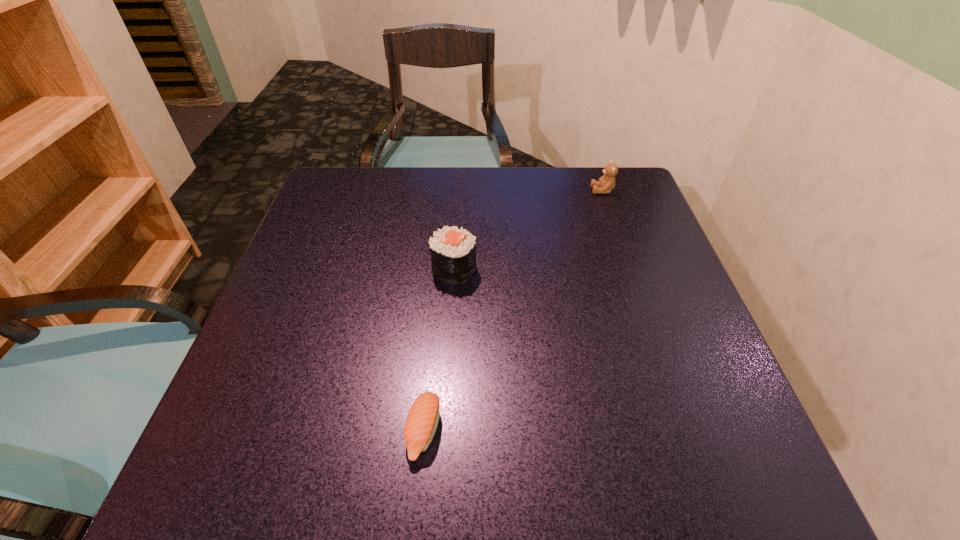
The image size is (960, 540). Find the location of `free region at the far right corner of the desktop`. free region at the far right corner of the desktop is located at coordinates (609, 201).

The height and width of the screenshot is (540, 960). Identify the location of vacant region between the nearer sushi and the rightmost object. (513, 311).

The image size is (960, 540). Identify the location of free spot between the taller sushi and the teddy bear. (528, 230).

Where is `blank region between the second nearest object and the nearest object`? The height and width of the screenshot is (540, 960). blank region between the second nearest object and the nearest object is located at coordinates (439, 350).

I want to click on free point between the shorter sushi and the farther sushi, so click(x=439, y=350).

Where is `free space between the nearest object and the second nearest object`? The width and height of the screenshot is (960, 540). free space between the nearest object and the second nearest object is located at coordinates (439, 350).

Find the location of `vacant region between the farthest object and the nearest object`. vacant region between the farthest object and the nearest object is located at coordinates (513, 311).

What are the coordinates of `empty location between the farthest object and the farther sushi` in the screenshot? It's located at (528, 230).

This screenshot has width=960, height=540. I want to click on vacant area that lies between the shorter sushi and the farther sushi, so click(439, 350).

Locate an element on the screen. vacant region between the nearest object and the taller sushi is located at coordinates tap(439, 350).